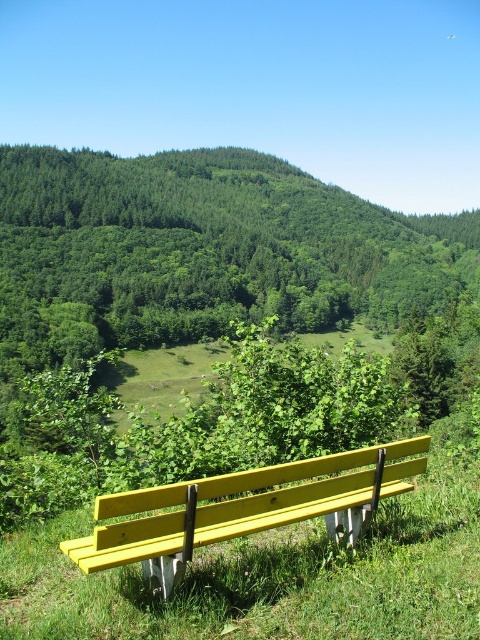
Question: Which object is closer to the camera taking this photo?

Choices:
 (A) green leafy tree at center
 (B) yellow painted wood bench at center

Answer: (B)

Question: Which of the following is the closest to the observer?

Choices:
 (A) green leafy tree at center
 (B) yellow painted wood bench at center

Answer: (B)

Question: Is green leafy tree at center thinner than yellow painted wood bench at center?

Choices:
 (A) yes
 (B) no

Answer: (B)

Question: Is green leafy tree at center to the right of yellow painted wood bench at center from the viewer's perspective?

Choices:
 (A) yes
 (B) no

Answer: (B)

Question: Observing the image, what is the correct spatial positioning of green leafy tree at center in reference to yellow painted wood bench at center?

Choices:
 (A) above
 (B) below

Answer: (A)